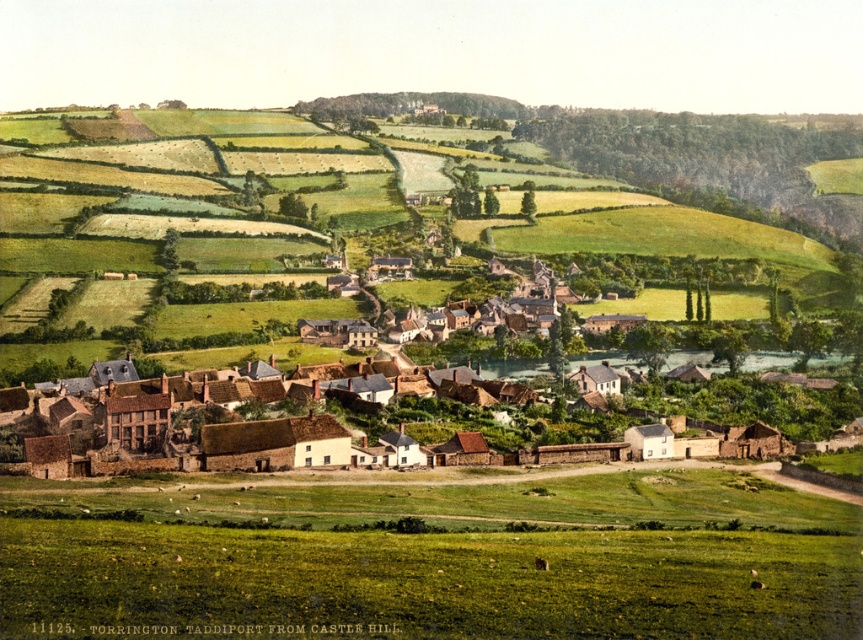
Question: Is green grass at lower center below brown brick houses at center?

Choices:
 (A) no
 (B) yes

Answer: (B)

Question: Which point is farther to the camera?

Choices:
 (A) (860, 534)
 (B) (230, 451)

Answer: (B)

Question: Does green grass at lower center appear on the right side of brown brick houses at center?

Choices:
 (A) no
 (B) yes

Answer: (A)

Question: Is green grass at lower center positioned behind brown brick houses at center?

Choices:
 (A) no
 (B) yes

Answer: (A)

Question: Which point is closer to the camera taking this photo?

Choices:
 (A) (552, 522)
 (B) (523, 356)

Answer: (A)

Question: Which object appears farthest from the camera in this image?

Choices:
 (A) brown brick houses at center
 (B) green grass at lower center

Answer: (A)